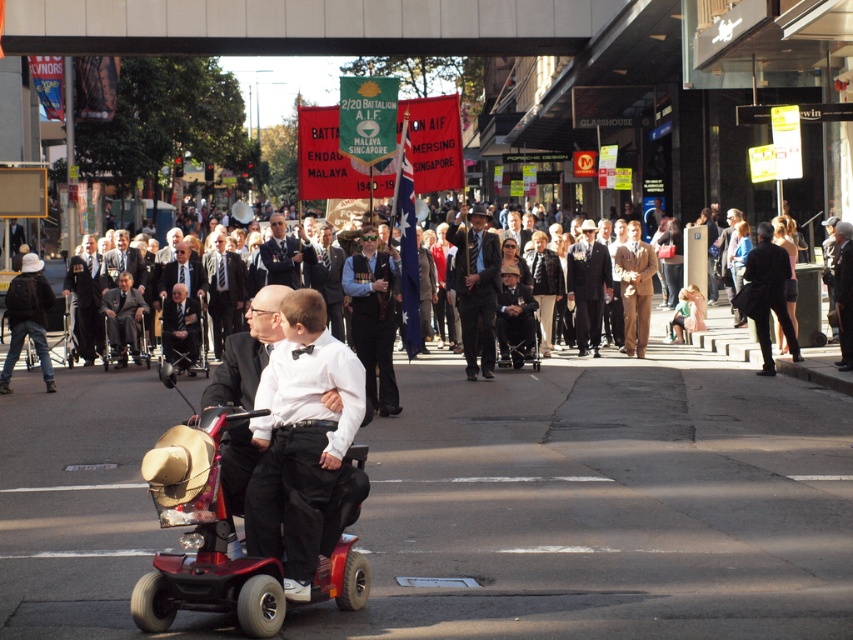
You are standing at the point marked by the coordinates point (474, 288). Looking around, you see a dark gray suit at center. What object is located exactly at your current position?

The dark gray suit at center is located at point (474, 288).

You are a photographer at the event and want to capture both the dark gray suit at center and the dark suit at center in a single photo. Which one should you focus on first to ensure the subject is in the foreground?

The dark gray suit at center is above dark suit at center, so you should focus on the dark gray suit at center first to ensure it appears in the foreground.

You are a photographer at the event and want to capture both the dark blue suit at center and the dark suit at center in the same frame. Which one should you focus on first to ensure both are in focus?

The dark blue suit at center is taller than the dark suit at center, so focusing on the taller dark blue suit at center first will help ensure both are in focus as it requires adjusting the focus to accommodate the height difference.